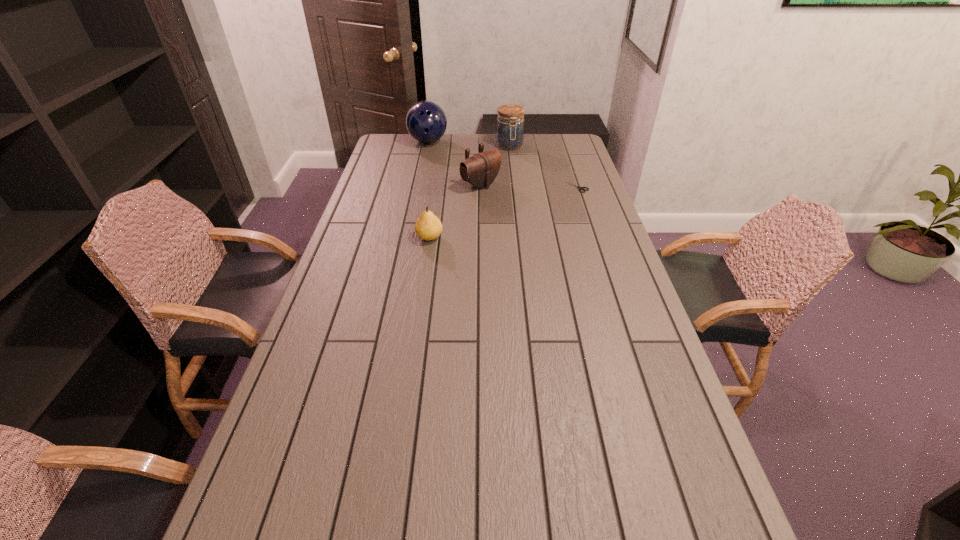
The height and width of the screenshot is (540, 960). Identify the location of object present at the left edge. (426, 122).

What are the coordinates of `object that is at the right edge` in the screenshot? It's located at (580, 188).

Find the location of `object that is positioned at the far left corner`. object that is positioned at the far left corner is located at coordinates (426, 122).

Find the location of a particular element. free spot at the far edge of the desktop is located at coordinates (448, 141).

This screenshot has width=960, height=540. In the image, there is a desktop. Identify the location of vacant area at the left edge. (316, 328).

The image size is (960, 540). Find the location of `free spot at the right edge of the desktop`. free spot at the right edge of the desktop is located at coordinates (664, 427).

Where is `vacant space at the near right corner`? Image resolution: width=960 pixels, height=540 pixels. vacant space at the near right corner is located at coordinates (637, 480).

Image resolution: width=960 pixels, height=540 pixels. I want to click on vacant space that is in between the pouch and the nearest object, so click(x=455, y=211).

Locate an element on the screen. The image size is (960, 540). free space between the shortest object and the jar is located at coordinates (542, 166).

Where is `free spot between the jar and the shears`? The width and height of the screenshot is (960, 540). free spot between the jar and the shears is located at coordinates (542, 166).